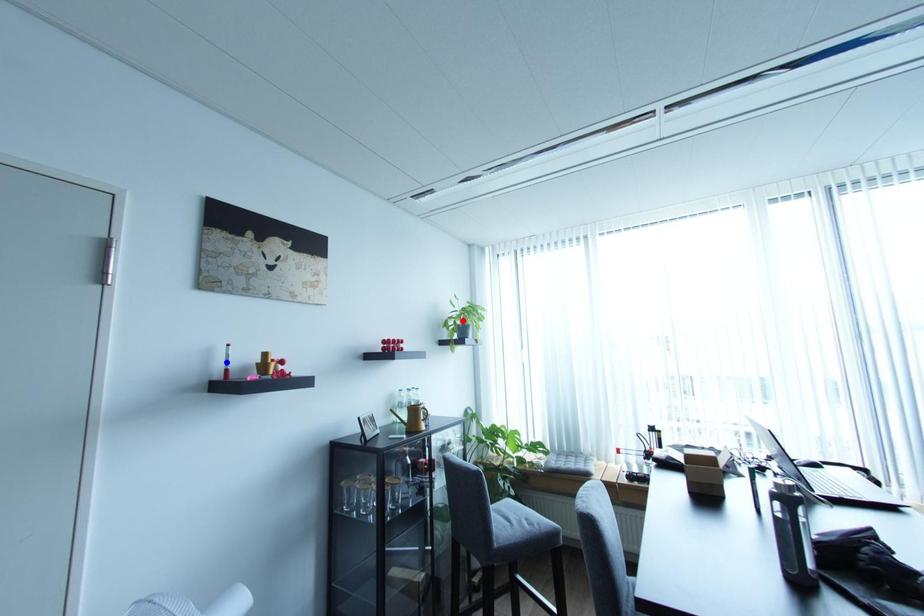
Question: Two points are marked on the image. Which point is closer to the camera?

Choices:
 (A) Blue point is closer.
 (B) Red point is closer.

Answer: (A)